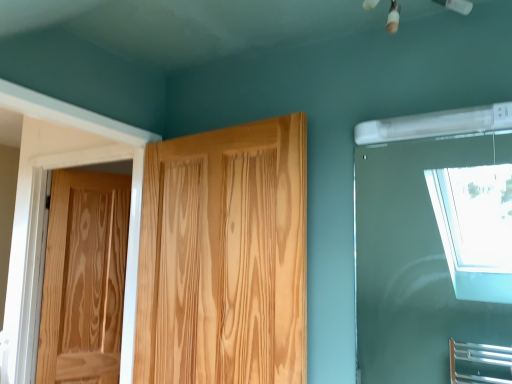
Measure the distance between point (158,292) and camera.

They are 1.67 meters apart.

Identify the location of natural wood door at center, the first door viewed from the right. (224, 257).

From a real-world perspective, between transparent glass window at upper right and natural wood door at center, the second door viewed from the left, who is vertically higher?

transparent glass window at upper right is physically above.

Which object is more forward, transparent glass window at upper right or natural wood door at center, the second door viewed from the left?

Positioned in front is transparent glass window at upper right.

Considering the sizes of transparent glass window at upper right and natural wood door at center, placed as the first door when sorted from front to back, in the image, is transparent glass window at upper right bigger or smaller than natural wood door at center, placed as the first door when sorted from front to back,?

Clearly, transparent glass window at upper right is smaller in size than natural wood door at center, placed as the first door when sorted from front to back.

Looking at the image, does natural wood door at center, the second door viewed from the left, seem bigger or smaller compared to natural wood door at left, which is the 2th door in front-to-back order?

Clearly, natural wood door at center, the second door viewed from the left, is larger in size than natural wood door at left, which is the 2th door in front-to-back order.

Is natural wood door at center, arranged as the second door when viewed from the back, positioned with its back to natural wood door at left, which is the 2th door in front-to-back order?

Result: That's not correct — natural wood door at center, arranged as the second door when viewed from the back, is not looking away from natural wood door at left, which is the 2th door in front-to-back order.

From the image's perspective, which one is positioned higher, natural wood door at center, placed as the first door when sorted from front to back, or natural wood door at left, placed as the first door when sorted from left to right?

natural wood door at center, placed as the first door when sorted from front to back.

Considering the sizes of objects natural wood door at center, placed as the first door when sorted from front to back, and natural wood door at left, the second door positioned from the right, in the image provided, who is thinner, natural wood door at center, placed as the first door when sorted from front to back, or natural wood door at left, the second door positioned from the right,?

Thinner between the two is natural wood door at left, the second door positioned from the right.

How many degrees apart are the facing directions of natural wood door at center, arranged as the second door when viewed from the back, and transparent glass window at upper right?

natural wood door at center, arranged as the second door when viewed from the back, and transparent glass window at upper right are facing 4.69 degrees away from each other.

From a real-world perspective, is natural wood door at center, placed as the first door when sorted from front to back, on top of transparent glass window at upper right?

No.

Is natural wood door at center, arranged as the second door when viewed from the back, positioned beyond the bounds of transparent glass window at upper right?

natural wood door at center, arranged as the second door when viewed from the back, is positioned outside transparent glass window at upper right.

Looking at this image, considering the positions of objects natural wood door at center, the first door viewed from the right, and transparent glass window at upper right in the image provided, who is more to the right, natural wood door at center, the first door viewed from the right, or transparent glass window at upper right?

transparent glass window at upper right is more to the right.

Does point (94, 307) come farther from viewer compared to point (411, 195)?

Yes, point (94, 307) is behind point (411, 195).

From their relative heights in the image, would you say natural wood door at left, placed as the first door when sorted from back to front, is taller or shorter than transparent glass window at upper right?

In the image, natural wood door at left, placed as the first door when sorted from back to front, appears to be taller than transparent glass window at upper right.

Is transparent glass window at upper right at the back of natural wood door at left, the second door positioned from the right?

No.

Which of these two, natural wood door at left, the second door positioned from the right, or transparent glass window at upper right, is thinner?

transparent glass window at upper right is thinner.

From a real-world perspective, between transparent glass window at upper right and natural wood door at left, placed as the first door when sorted from back to front, who is vertically higher?

transparent glass window at upper right.

Is natural wood door at left, the second door positioned from the right, completely or partially inside transparent glass window at upper right?

Definitely not — natural wood door at left, the second door positioned from the right, is not inside transparent glass window at upper right.

Consider the image. Who is shorter, transparent glass window at upper right or natural wood door at left, placed as the first door when sorted from back to front?

Standing shorter between the two is transparent glass window at upper right.

Is transparent glass window at upper right wider or thinner than natural wood door at left, which is the 2th door in front-to-back order?

In the image, transparent glass window at upper right appears to be more narrow than natural wood door at left, which is the 2th door in front-to-back order.

Where is `door in front of the natural wood door at left, which is the 2th door in front-to-back order`? This screenshot has height=384, width=512. door in front of the natural wood door at left, which is the 2th door in front-to-back order is located at coordinates coord(224,257).

Is natural wood door at left, the second door positioned from the right, facing away from natural wood door at center, arranged as the second door when viewed from the back?

natural wood door at left, the second door positioned from the right, does not have its back to natural wood door at center, arranged as the second door when viewed from the back.

Looking at this image, which of these two, natural wood door at left, placed as the first door when sorted from left to right, or natural wood door at center, the second door viewed from the left, is bigger?

natural wood door at center, the second door viewed from the left.

Does natural wood door at left, placed as the first door when sorted from back to front, have a lesser width compared to natural wood door at center, the second door viewed from the left?

Indeed, natural wood door at left, placed as the first door when sorted from back to front, has a lesser width compared to natural wood door at center, the second door viewed from the left.

This screenshot has width=512, height=384. I want to click on window lying above the natural wood door at center, placed as the first door when sorted from front to back (from the image's perspective), so click(x=431, y=253).

Locate an element on the screen. The height and width of the screenshot is (384, 512). door below the natural wood door at center, the first door viewed from the right (from a real-world perspective) is located at coordinates coord(84,278).

Estimate the real-world distances between objects in this image. Which object is closer to transparent glass window at upper right, natural wood door at center, the first door viewed from the right, or natural wood door at left, placed as the first door when sorted from left to right?

natural wood door at center, the first door viewed from the right.

Which object lies nearer to the anchor point natural wood door at center, the second door viewed from the left, transparent glass window at upper right or natural wood door at left, placed as the first door when sorted from back to front?

Among the two, natural wood door at left, placed as the first door when sorted from back to front, is located nearer to natural wood door at center, the second door viewed from the left.

Considering their positions, is natural wood door at center, the first door viewed from the right, positioned closer to natural wood door at left, placed as the first door when sorted from left to right, than transparent glass window at upper right?

natural wood door at center, the first door viewed from the right, lies closer to natural wood door at left, placed as the first door when sorted from left to right, than the other object.

From the image, which object appears to be farther from natural wood door at center, placed as the first door when sorted from front to back, natural wood door at left, which is the 2th door in front-to-back order, or transparent glass window at upper right?

transparent glass window at upper right is positioned further to the anchor natural wood door at center, placed as the first door when sorted from front to back.

Looking at this image, when comparing their distances from transparent glass window at upper right, does natural wood door at left, the second door positioned from the right, or natural wood door at center, arranged as the second door when viewed from the back, seem closer?

Based on the image, natural wood door at center, arranged as the second door when viewed from the back, appears to be nearer to transparent glass window at upper right.

Considering their positions, is transparent glass window at upper right positioned further to natural wood door at left, placed as the first door when sorted from back to front, than natural wood door at center, the second door viewed from the left?

The object further to natural wood door at left, placed as the first door when sorted from back to front, is transparent glass window at upper right.

At what (x,y) coordinates should I click in order to perform the action: click on door between natural wood door at left, placed as the first door when sorted from left to right, and transparent glass window at upper right. Please return your answer as a coordinate pair (x, y). Looking at the image, I should click on (224, 257).